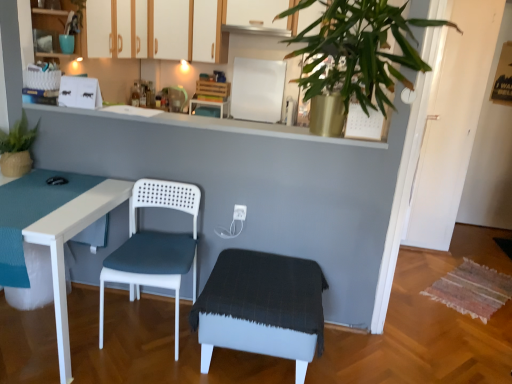
Where is `free location to the right of matte green plant at left`? Image resolution: width=512 pixels, height=384 pixels. free location to the right of matte green plant at left is located at coordinates (52, 182).